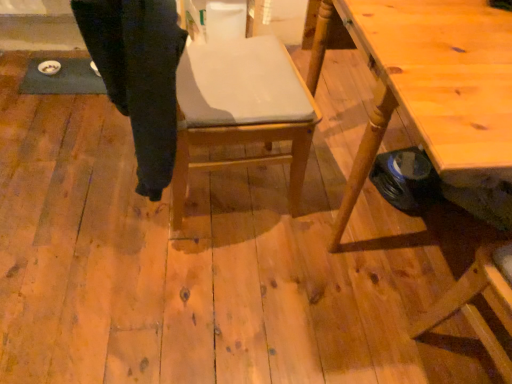
The image size is (512, 384). What are the coordinates of `free spot to the left of wooden table at right` in the screenshot? It's located at (189, 263).